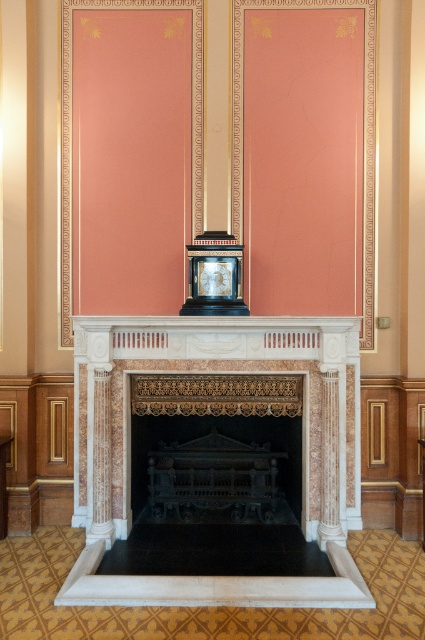
Question: Which point is closer to the camera?

Choices:
 (A) marble fireplace at center
 (B) black marble fireplace at center

Answer: (A)

Question: Which point is closer to the camera taking this photo?

Choices:
 (A) (167, 440)
 (B) (192, 323)
 (C) (218, 284)

Answer: (B)

Question: Does black marble fireplace at center have a smaller size compared to matte black clock at center?

Choices:
 (A) no
 (B) yes

Answer: (A)

Question: Is black marble fireplace at center further to camera compared to matte black clock at center?

Choices:
 (A) no
 (B) yes

Answer: (B)

Question: Can you confirm if marble fireplace at center is thinner than matte black clock at center?

Choices:
 (A) no
 (B) yes

Answer: (A)

Question: Which object is farther from the camera taking this photo?

Choices:
 (A) black marble fireplace at center
 (B) marble fireplace at center

Answer: (A)